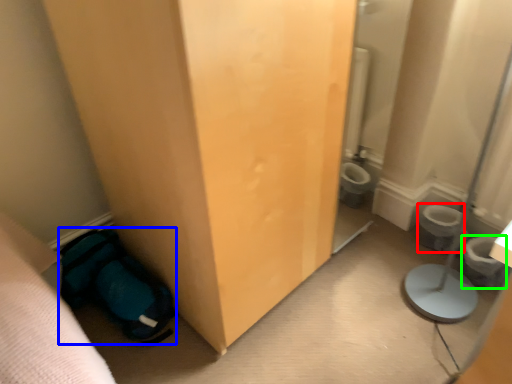
Question: Considering the real-world distances, which object is closest to toilet bowl (highlighted by a red box)? sleeping bag (highlighted by a blue box) or potty (highlighted by a green box).

Choices:
 (A) sleeping bag
 (B) potty

Answer: (B)